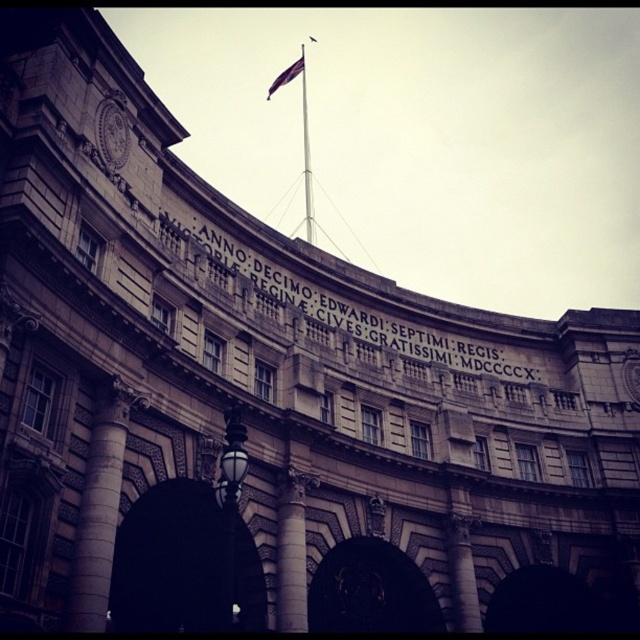
Is stone inscription at center positioned at the back of metallic flag pole at center?

No, it is not.

Identify the location of stone inscription at center. This screenshot has width=640, height=640. (346, 307).

Identify the location of stone inscription at center. (346, 307).

Based on the photo, does polished brass streetlight at lower left appear on the right side of silky purple flag at center?

Correct, you'll find polished brass streetlight at lower left to the right of silky purple flag at center.

Is point (241, 460) farther from viewer compared to point (269, 92)?

No, it is in front of (269, 92).

Does point (236, 499) come closer to viewer compared to point (268, 96)?

Yes, point (236, 499) is closer to viewer.

Locate an element on the screen. The width and height of the screenshot is (640, 640). polished brass streetlight at lower left is located at coordinates 228,502.

The image size is (640, 640). I want to click on stone column at center, so click(291, 552).

Who is positioned more to the left, stone column at center or polished brass streetlight at lower left?

polished brass streetlight at lower left

The image size is (640, 640). Identify the location of stone column at center. (291, 552).